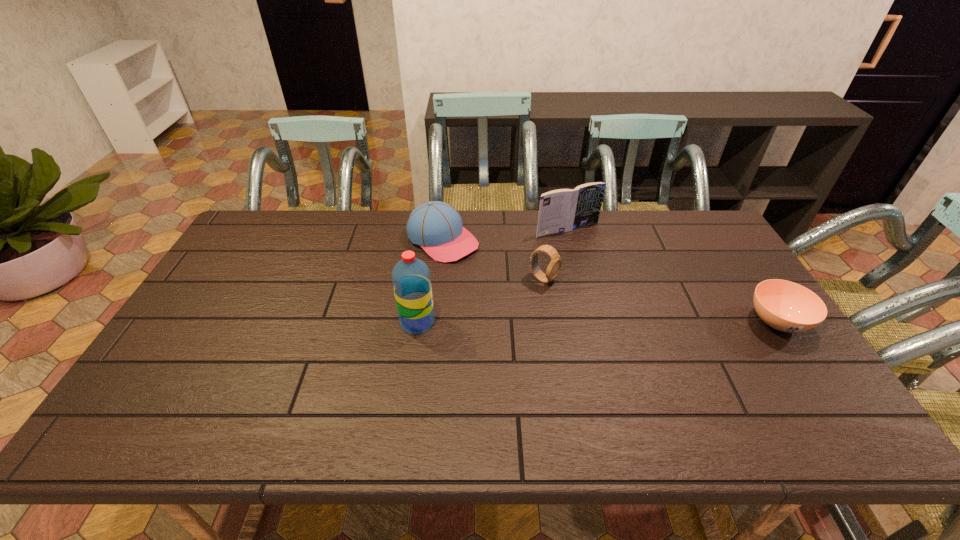
What are the coordinates of `free spot on the desktop that is between the water bottle and the rightmost object and is positioned on the face of the third farthest object` in the screenshot? It's located at (626, 322).

This screenshot has height=540, width=960. Find the location of `free spot on the desktop that is between the tallest object and the rightmost object and is positioned on the front cover of the book`. free spot on the desktop that is between the tallest object and the rightmost object and is positioned on the front cover of the book is located at coordinates (648, 322).

Locate an element on the screen. The width and height of the screenshot is (960, 540). free spot on the desktop that is between the water bottle and the shortest object and is positioned on the front-facing side of the baseball cap is located at coordinates 559,322.